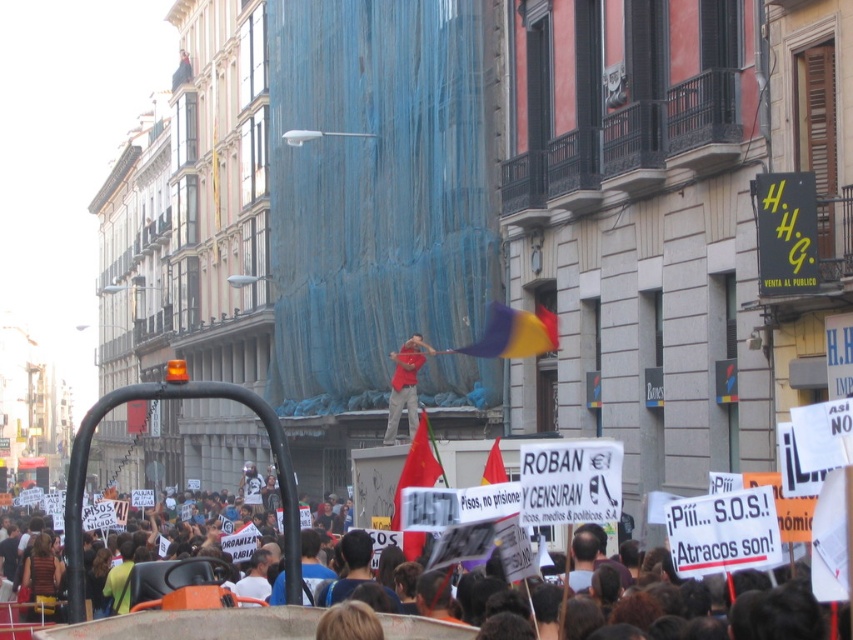
Question: Does red flag at center have a larger size compared to red cotton shirt at center?

Choices:
 (A) no
 (B) yes

Answer: (B)

Question: Which object is closer to the camera taking this photo?

Choices:
 (A) red flag at center
 (B) polyester flag at center

Answer: (A)

Question: Which object is closer to the camera taking this photo?

Choices:
 (A) polyester flag at center
 (B) red cotton shirt at center
 (C) red flag at center

Answer: (C)

Question: Among these points, which one is nearest to the camera?

Choices:
 (A) (502, 339)
 (B) (233, 621)
 (C) (390, 380)

Answer: (B)

Question: Does red flag at center lie behind red cotton shirt at center?

Choices:
 (A) no
 (B) yes

Answer: (A)

Question: Is red flag at center wider than red cotton shirt at center?

Choices:
 (A) no
 (B) yes

Answer: (B)